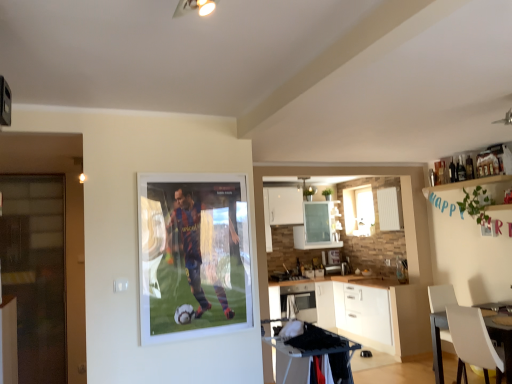
Measure the distance between point (33, 213) and camera.

Point (33, 213) is 4.43 meters away from camera.

At what (x,y) coordinates should I click in order to perform the action: click on transparent glass door at left. Please return your answer as a coordinate pair (x, y). Looking at the image, I should click on (36, 272).

Image resolution: width=512 pixels, height=384 pixels. Find the location of `white glossy window at center`. white glossy window at center is located at coordinates (358, 210).

Identify the location of glass door located above the white glossy cabinet at lower center (from the image's perspective). (36, 272).

From the image's perspective, is transparent glass door at left positioned above or below white glossy cabinet at lower center?

Clearly, from the image's perspective, transparent glass door at left is above white glossy cabinet at lower center.

Can you confirm if transparent glass door at left is positioned to the left of white glossy cabinet at lower center?

Indeed, transparent glass door at left is positioned on the left side of white glossy cabinet at lower center.

Considering the positions of point (36, 281) and point (361, 323), is point (36, 281) closer or farther from the camera than point (361, 323)?

Point (36, 281) is positioned closer to the camera compared to point (361, 323).

Is point (301, 293) closer to camera compared to point (335, 358)?

No, (301, 293) is behind (335, 358).

Is white glossy microwave at center looking in the opposite direction of black plastic table at lower center?

white glossy microwave at center does not have its back to black plastic table at lower center.

From the image's perspective, is white glossy microwave at center located above black plastic table at lower center?

No, from the image's perspective, white glossy microwave at center is not over black plastic table at lower center.

In the scene shown: Measure the distance between white glossy microwave at center and black plastic table at lower center.

The distance of white glossy microwave at center from black plastic table at lower center is 7.52 feet.

Is black plastic table at lower center bigger than transparent glass door at left?

Incorrect, black plastic table at lower center is not larger than transparent glass door at left.

From the image's perspective, who appears lower, black plastic table at lower center or transparent glass door at left?

black plastic table at lower center.

I want to click on glass door on the left of black plastic table at lower center, so click(x=36, y=272).

Which is correct: black plastic table at lower center is inside transparent glass door at left, or outside of it?

black plastic table at lower center is located beyond the bounds of transparent glass door at left.

Consider the image. Would you say white glossy window at center is inside or outside white glossy cabinet at lower center?

white glossy window at center is not inside white glossy cabinet at lower center, it's outside.

From a real-world perspective, is white glossy window at center below white glossy cabinet at lower center?

No.

How distant is white glossy window at center from white glossy cabinet at lower center?

The distance of white glossy window at center from white glossy cabinet at lower center is 1.13 meters.

At what (x,y) coordinates should I click in order to perform the action: click on cabinetry below the white glossy window at center (from the image's perspective). Please return your answer as a coordinate pair (x, y). The width and height of the screenshot is (512, 384). Looking at the image, I should click on (364, 314).

How far apart are white glossy microwave at center and white glossy window at center?

A distance of 4.02 feet exists between white glossy microwave at center and white glossy window at center.

Is white glossy window at center surrounded by white glossy microwave at center?

No, white glossy window at center is not inside white glossy microwave at center.

From a real-world perspective, is white glossy microwave at center located higher than white glossy window at center?

Actually, white glossy microwave at center is physically below white glossy window at center in the real world.

Does black plastic table at lower center have a larger size compared to white glossy cabinet at lower center?

No, black plastic table at lower center is not bigger than white glossy cabinet at lower center.

From the image's perspective, is black plastic table at lower center on white glossy cabinet at lower center?

Correct, black plastic table at lower center appears higher than white glossy cabinet at lower center in the image.

Between black plastic table at lower center and white glossy cabinet at lower center, which one is positioned behind?

white glossy cabinet at lower center is behind.

Which is more to the right, black plastic table at lower center or white glossy cabinet at lower center?

Positioned to the right is white glossy cabinet at lower center.

Considering their positions, is white plastic chair at lower right located in front of or behind white glossy cabinet at lower center?

white plastic chair at lower right is positioned closer to the viewer than white glossy cabinet at lower center.

How distant is white plastic chair at lower right from white glossy cabinet at lower center?

They are 38.29 inches apart.

Is white plastic chair at lower right shorter than white glossy cabinet at lower center?

Correct, white plastic chair at lower right is not as tall as white glossy cabinet at lower center.

Can you confirm if white plastic chair at lower right is wider than white glossy cabinet at lower center?

Correct, the width of white plastic chair at lower right exceeds that of white glossy cabinet at lower center.

Find the location of `cabinetry that is under the transparent glass door at left (from a real-world perspective)`. cabinetry that is under the transparent glass door at left (from a real-world perspective) is located at coordinates (364, 314).

The width and height of the screenshot is (512, 384). I want to click on table located above the white glossy microwave at center (from a real-world perspective), so click(313, 357).

Estimate the real-world distances between objects in this image. Which object is closer to white glossy microwave at center, white glossy cabinet at lower center or white glossy window at center?

Among the two, white glossy cabinet at lower center is located nearer to white glossy microwave at center.

From the image, which object appears to be farther from transparent glass door at left, white glossy cabinet at lower center or white glossy window at center?

white glossy window at center is positioned further to the anchor transparent glass door at left.

When comparing their distances from white glossy window at center, does transparent glass door at left or white glossy microwave at center seem further?

transparent glass door at left lies further to white glossy window at center than the other object.

Based on their spatial positions, is white plastic chair at lower right or transparent glass door at left closer to white glossy microwave at center?

The object closer to white glossy microwave at center is white plastic chair at lower right.

Based on their spatial positions, is white glossy cabinet at lower center or black plastic table at lower center further from white glossy microwave at center?

black plastic table at lower center is further to white glossy microwave at center.

Based on their spatial positions, is white plastic chair at lower right or white glossy window at center closer to black plastic table at lower center?

white plastic chair at lower right lies closer to black plastic table at lower center than the other object.

Estimate the real-world distances between objects in this image. Which object is further from transparent glass door at left, white glossy cabinet at lower center or black plastic table at lower center?

Answer: Based on the image, white glossy cabinet at lower center appears to be further to transparent glass door at left.

Based on their spatial positions, is white glossy microwave at center or black plastic table at lower center further from white glossy window at center?

The object further to white glossy window at center is black plastic table at lower center.

Find the location of a particular element. table located between transparent glass door at left and white glossy window at center in the left-right direction is located at coordinates (313, 357).

This screenshot has height=384, width=512. I want to click on appliance situated between transparent glass door at left and white glossy window at center from left to right, so click(x=298, y=302).

Locate an element on the screen. The height and width of the screenshot is (384, 512). chair positioned between black plastic table at lower center and white glossy window at center from near to far is located at coordinates (441, 297).

Identify the location of cabinetry between white plastic chair at lower right and white glossy microwave at center from front to back. The width and height of the screenshot is (512, 384). (364, 314).